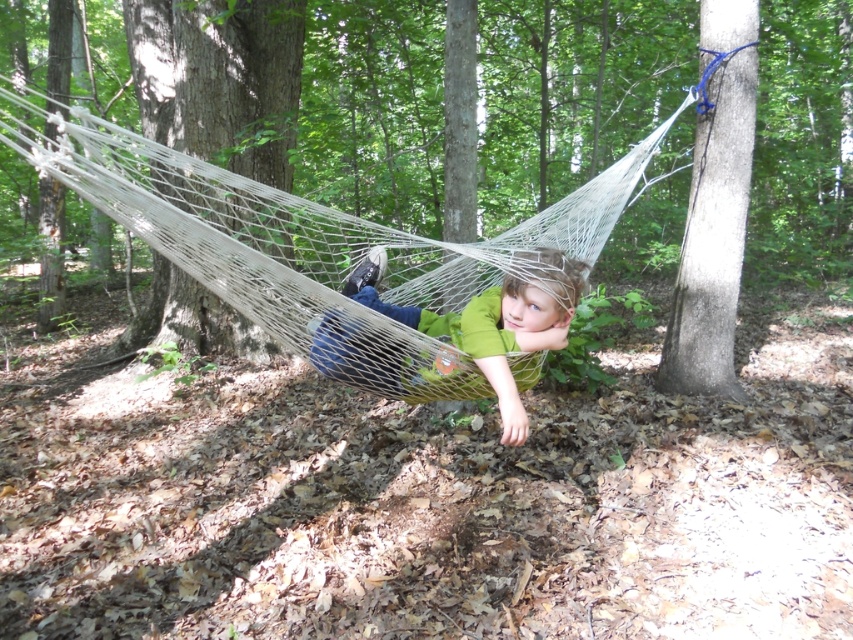
Question: Which point is farther to the camera?

Choices:
 (A) (289, 125)
 (B) (547, 232)

Answer: (A)

Question: Does brown rough tree at center appear on the right side of smooth gray bark at upper left?

Choices:
 (A) yes
 (B) no

Answer: (A)

Question: Does brown rough tree at center appear under smooth gray bark at upper left?

Choices:
 (A) yes
 (B) no

Answer: (B)

Question: Can you confirm if smooth gray bark at upper left is positioned above green fabric child at center?

Choices:
 (A) yes
 (B) no

Answer: (A)

Question: Which object is closer to the camera taking this photo?

Choices:
 (A) green fabric child at center
 (B) smooth gray bark at upper right

Answer: (A)

Question: Which object is positioned closest to the green fabric child at center?

Choices:
 (A) brown rough tree at center
 (B) smooth gray bark at upper right

Answer: (A)